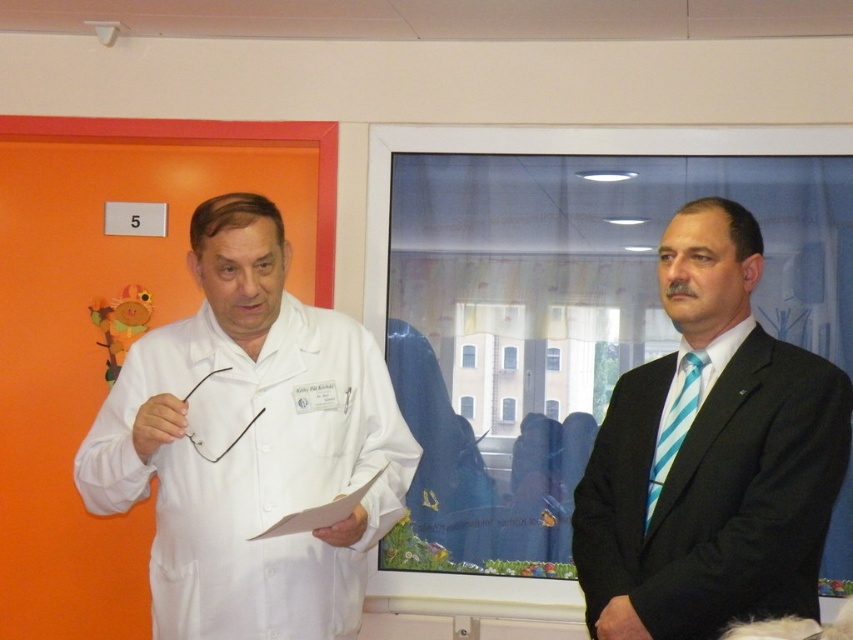
Question: Considering the relative positions of white matte lab coat at left and teal striped tie at right in the image provided, where is white matte lab coat at left located with respect to teal striped tie at right?

Choices:
 (A) right
 (B) left

Answer: (B)

Question: Which is farther from the matte white coat at center?

Choices:
 (A) teal striped tie at right
 (B) white matte lab coat at left

Answer: (B)

Question: Is white matte lab coat at left wider than teal striped tie at right?

Choices:
 (A) no
 (B) yes

Answer: (B)

Question: Considering the relative positions of white matte lab coat at left and matte white coat at center in the image provided, where is white matte lab coat at left located with respect to matte white coat at center?

Choices:
 (A) right
 (B) left

Answer: (B)

Question: Among these objects, which one is farthest from the camera?

Choices:
 (A) matte white coat at center
 (B) teal striped tie at right
 (C) white matte lab coat at left

Answer: (B)

Question: Which point is farther to the camera?

Choices:
 (A) (306, 323)
 (B) (663, 420)
 (C) (691, 577)

Answer: (A)